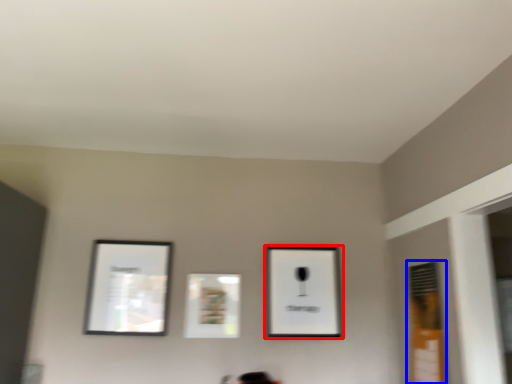
Question: Which object appears closest to the camera in this image, picture frame (highlighted by a red box) or window (highlighted by a blue box)?

Choices:
 (A) picture frame
 (B) window

Answer: (B)